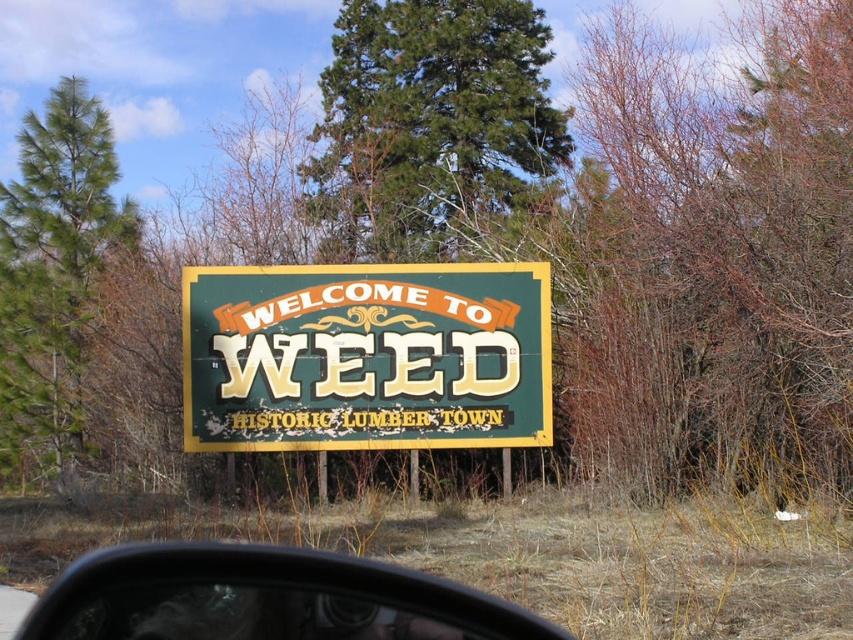
Is green vintage sign at center bigger than green pine tree at left?

Incorrect, green vintage sign at center is not larger than green pine tree at left.

Who is more distant from viewer, (212,296) or (103,218)?

Positioned behind is point (103,218).

This screenshot has height=640, width=853. Identify the location of green vintage sign at center. (366, 356).

Can you confirm if green pine tree at center is bigger than transparent plastic side mirror at lower center?

Yes.

Locate an element on the screen. Image resolution: width=853 pixels, height=640 pixels. green pine tree at center is located at coordinates (428, 122).

I want to click on green pine tree at center, so point(428,122).

Is point (393, 424) less distant than point (332, 620)?

No, (393, 424) is further to viewer.

Does green vintage sign at center have a greater height compared to transparent plastic side mirror at lower center?

Yes.

Between point (457, 364) and point (99, 627), which one is positioned in front?

Point (99, 627) is in front.

Where is `green vintage sign at center`? green vintage sign at center is located at coordinates (366, 356).